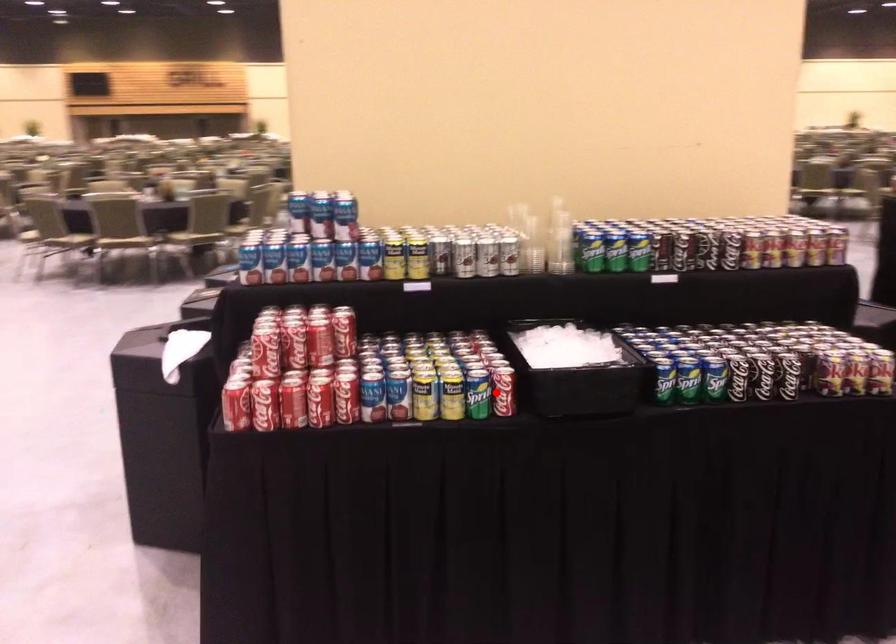
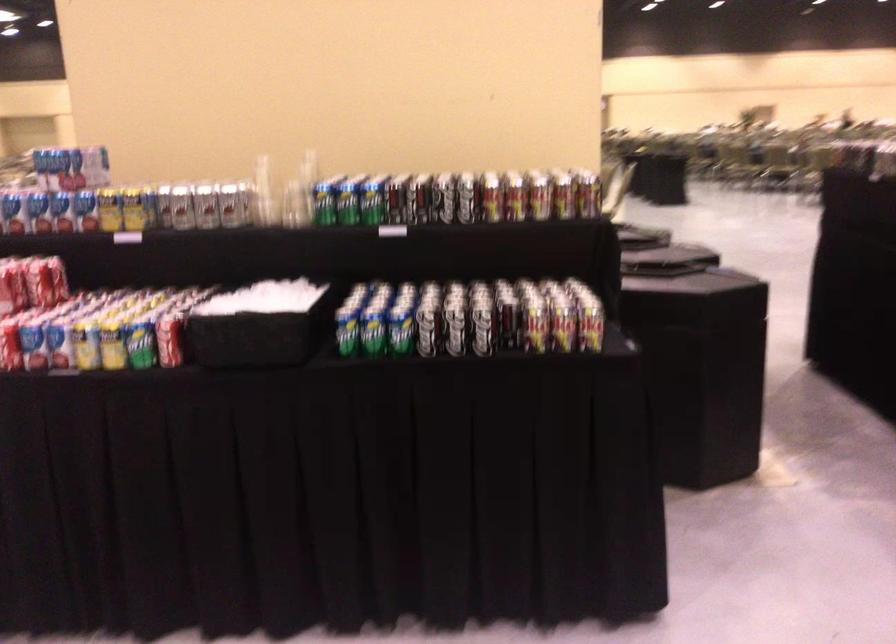
The point at the highlighted location is marked in the first image. Where is the corresponding point in the second image?

(169, 339)